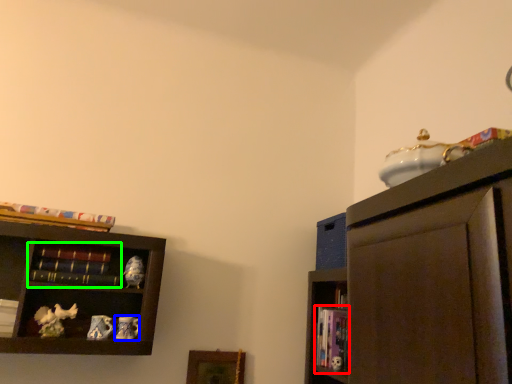
Question: Considering the real-world distances, which object is farthest from book (highlighted by a red box)? toy (highlighted by a blue box) or book (highlighted by a green box)?

Choices:
 (A) toy
 (B) book

Answer: (B)